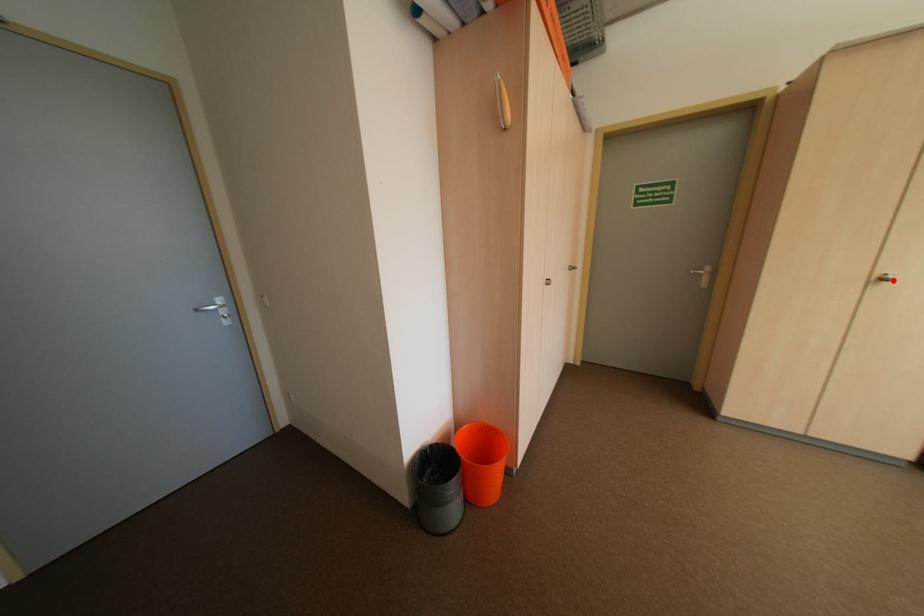
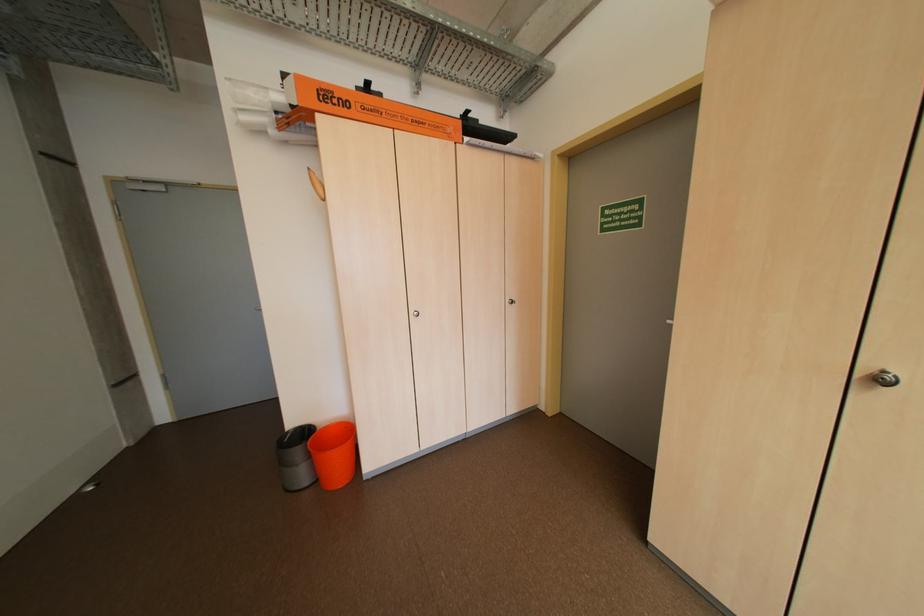
In the second image, find the point that corresponds to the highlighted location in the first image.

(891, 381)